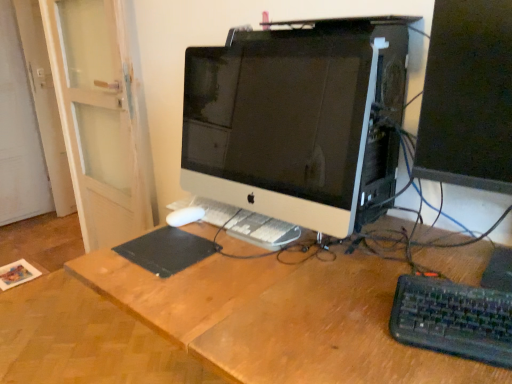
The height and width of the screenshot is (384, 512). Identify the location of free spot below matte black monitor at right, which is counted as the first computer monitor, starting from the right (from a real-world perspective). (448, 252).